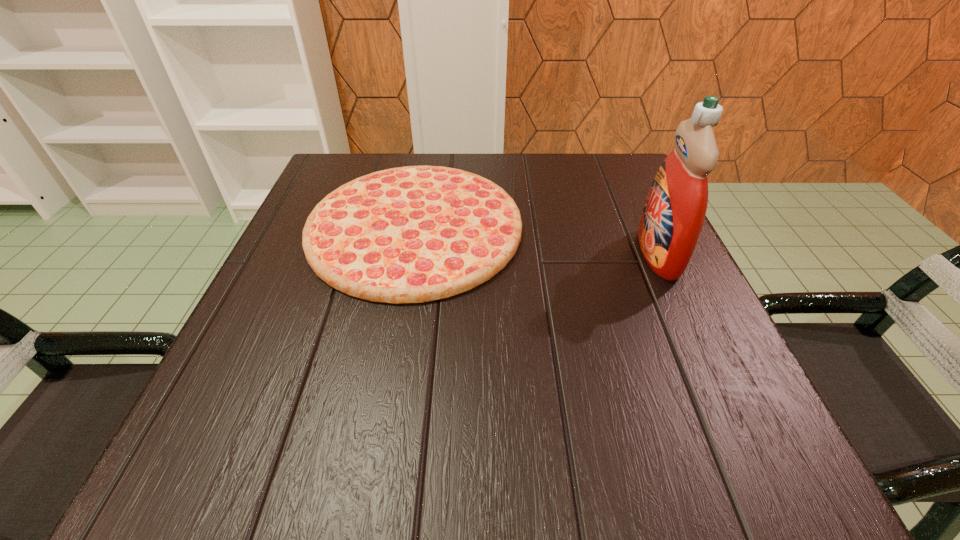
You are a GUI agent. You are given a task and a screenshot of the screen. Output one action in this format:
    pyautogui.click(x=<x>, y=<y>)
    Task: Click on the right object
    This screenshot has height=540, width=960.
    Given the screenshot: What is the action you would take?
    pyautogui.click(x=674, y=212)

Locate an element on the screen. This screenshot has width=960, height=540. the taller object is located at coordinates (674, 212).

In order to click on pizza in this screenshot , I will do `click(414, 234)`.

Image resolution: width=960 pixels, height=540 pixels. Identify the location of the shorter object. tap(414, 234).

Locate an element on the screen. This screenshot has width=960, height=540. vacant space located 0.230m on the front surface of the right object is located at coordinates (516, 254).

Image resolution: width=960 pixels, height=540 pixels. In order to click on free region located on the front surface of the right object in this screenshot , I will do `click(452, 254)`.

Identify the location of vacant area located 0.080m on the front surface of the right object. This screenshot has height=540, width=960. (596, 254).

The image size is (960, 540). What are the coordinates of `vacant space located on the front of the pizza` in the screenshot? It's located at (376, 443).

You are a GUI agent. You are given a task and a screenshot of the screen. Output one action in this format:
    pyautogui.click(x=<x>, y=<y>)
    Task: Click on the object situated at the far edge
    The height and width of the screenshot is (540, 960).
    Given the screenshot: What is the action you would take?
    pyautogui.click(x=414, y=234)

Where is `object present at the left edge`? The image size is (960, 540). object present at the left edge is located at coordinates (414, 234).